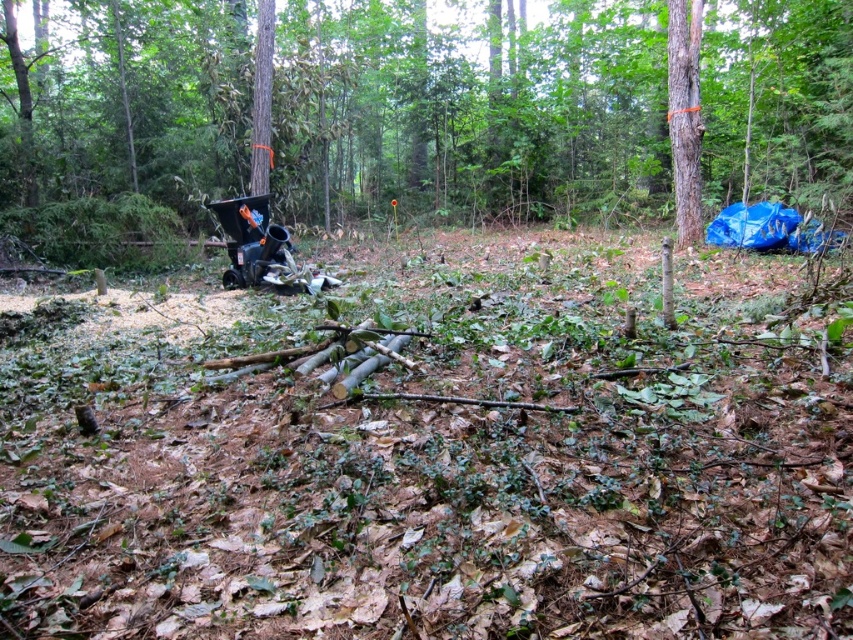
Is brown wood tree at center bigger than matte black baby carriage at center?

Indeed, brown wood tree at center has a larger size compared to matte black baby carriage at center.

Is brown wood tree at center below matte black baby carriage at center?

No.

Is point (103, 90) behind point (271, 260)?

Yes, point (103, 90) is farther from viewer.

Find the location of a particular element. brown wood tree at center is located at coordinates (471, 113).

Consider the image. Can you confirm if matte black baby carriage at center is taller than smooth bark tree at center?

No.

Which is behind, point (277, 256) or point (271, 33)?

Point (271, 33)

Where is `matte black baby carriage at center`? Image resolution: width=853 pixels, height=640 pixels. matte black baby carriage at center is located at coordinates (248, 237).

Who is more forward, (x=689, y=236) or (x=241, y=205)?

Point (x=241, y=205)

Which is in front, point (698, 218) or point (260, 234)?

Positioned in front is point (260, 234).

Locate an element on the screen. This screenshot has height=640, width=853. smooth bark tree at right is located at coordinates (685, 116).